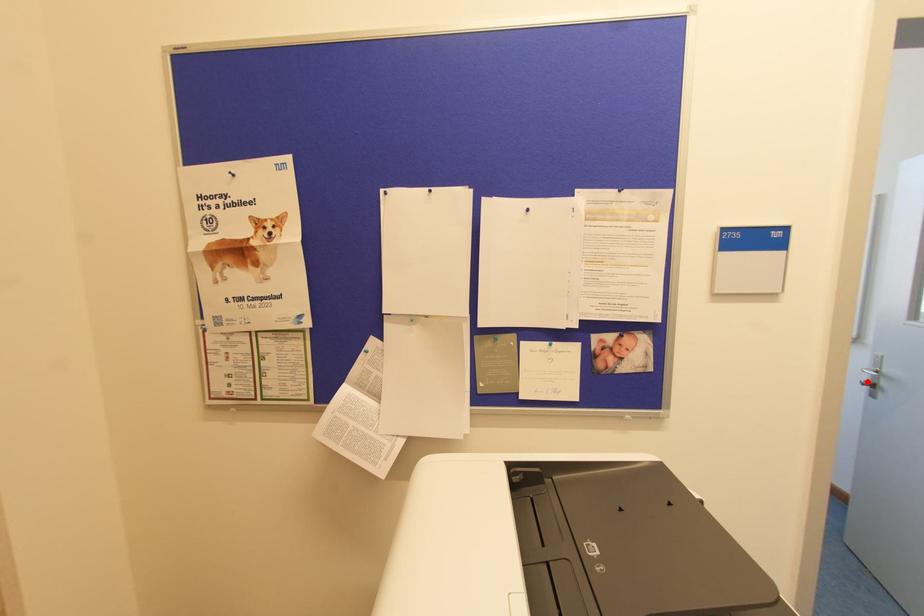
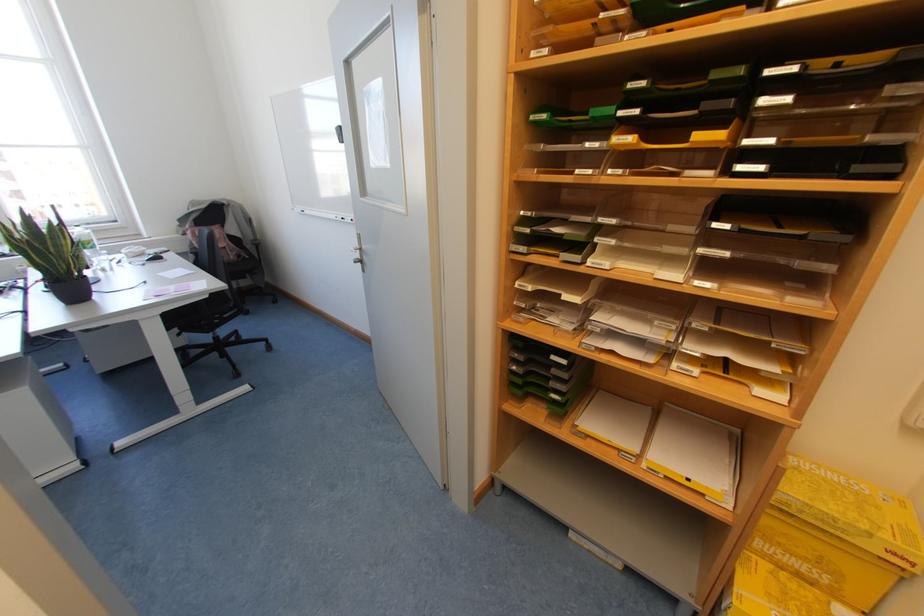
In the second image, find the point that corresponds to the highlighted location in the first image.

(358, 259)